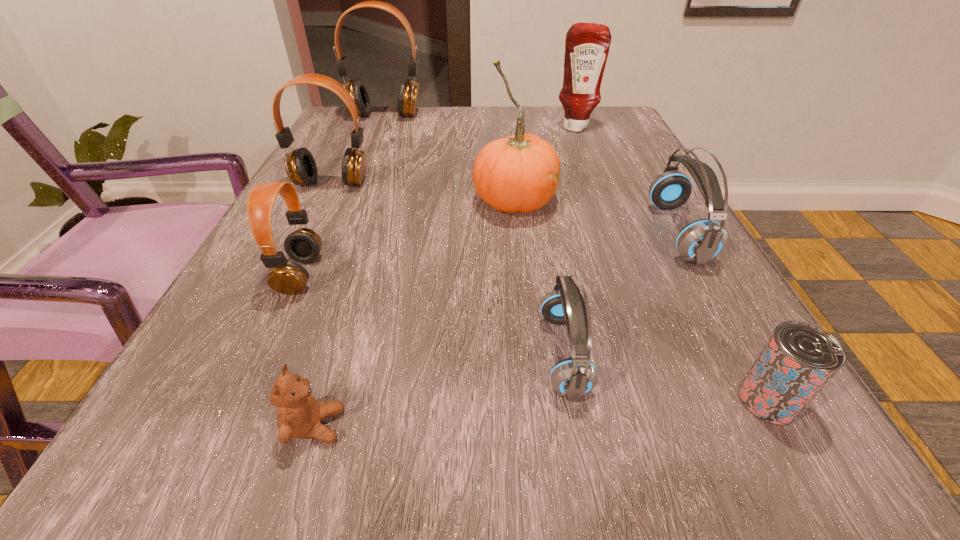
Image resolution: width=960 pixels, height=540 pixels. Identify the location of teddy bear that is positioned at the left edge. (299, 414).

Where is `condiment at the right edge`? The width and height of the screenshot is (960, 540). condiment at the right edge is located at coordinates (587, 45).

The width and height of the screenshot is (960, 540). I want to click on headset present at the right edge, so click(700, 241).

Image resolution: width=960 pixels, height=540 pixels. Find the location of `beer can located at the right edge`. beer can located at the right edge is located at coordinates (799, 359).

Where is `object present at the far left corner`? This screenshot has width=960, height=540. object present at the far left corner is located at coordinates (408, 91).

The height and width of the screenshot is (540, 960). In order to click on object located in the near left corner section of the desktop in this screenshot , I will do (299, 414).

The height and width of the screenshot is (540, 960). I want to click on object present at the far right corner, so click(587, 45).

In the image, there is a desktop. What are the coordinates of `blank space at the far edge` in the screenshot? It's located at (432, 120).

Locate an element on the screen. vacant space at the left edge of the desktop is located at coordinates (377, 151).

In the image, there is a desktop. Where is `free space at the right edge`? free space at the right edge is located at coordinates (746, 348).